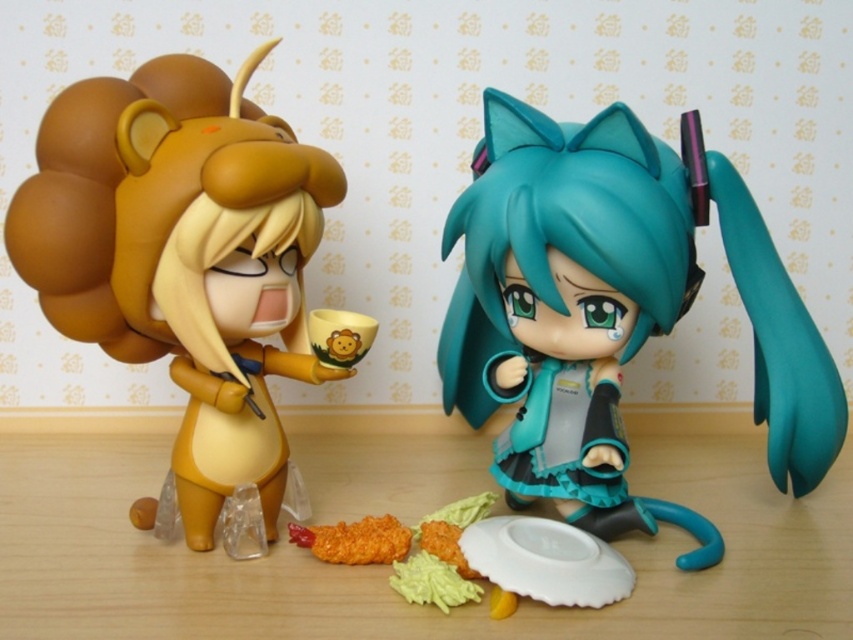
Is golden crispy chicken at center closer to the viewer compared to yellow matte cup at center?

No, it is behind yellow matte cup at center.

Is point (387, 532) positioned in front of point (328, 310)?

Yes, point (387, 532) is in front of point (328, 310).

Is point (316, 556) farther from viewer compared to point (347, 314)?

Yes, it is.

The height and width of the screenshot is (640, 853). In order to click on golden crispy chicken at center in this screenshot , I will do `click(354, 540)`.

Which is above, matte brown lion at left or yellow matte mashed potato at lower center?

Positioned higher is matte brown lion at left.

Which is in front, point (227, 342) or point (428, 566)?

Positioned in front is point (428, 566).

The width and height of the screenshot is (853, 640). Identify the location of matte brown lion at left. (183, 257).

Does matte brown lion at left appear over yellow matte cup at center?

Yes.

Is point (136, 90) more distant than point (328, 324)?

No, it is not.

The height and width of the screenshot is (640, 853). What are the coordinates of `matte brown lion at left` in the screenshot? It's located at (183, 257).